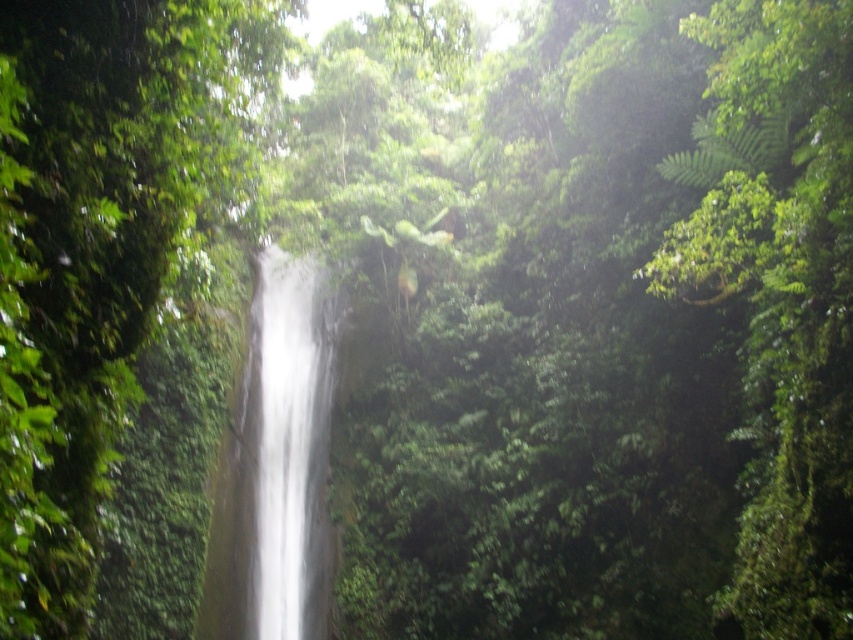
Question: Considering the real-world distances, which object is closest to the white smooth waterfall at center?

Choices:
 (A) green leafy tree at center
 (B) green leafy tree at right

Answer: (A)

Question: From the image, what is the correct spatial relationship of green leafy tree at center in relation to white smooth waterfall at center?

Choices:
 (A) right
 (B) left

Answer: (A)

Question: Is green leafy tree at right behind white smooth waterfall at center?

Choices:
 (A) no
 (B) yes

Answer: (A)

Question: Which object appears farthest from the camera in this image?

Choices:
 (A) green leafy tree at center
 (B) white smooth waterfall at center

Answer: (B)

Question: Is green leafy tree at center smaller than green leafy tree at right?

Choices:
 (A) no
 (B) yes

Answer: (B)

Question: Which object is farther from the camera taking this photo?

Choices:
 (A) white smooth waterfall at center
 (B) green leafy tree at center

Answer: (A)